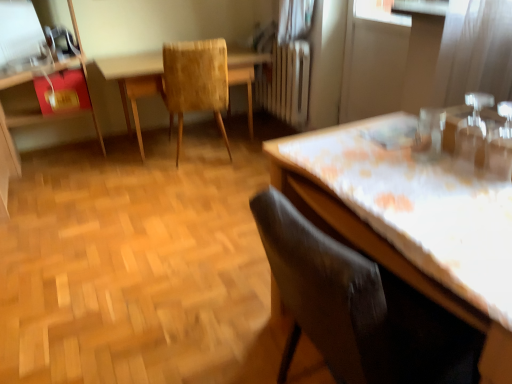
Where is `vacant space in matte red dresser at left (from a real-world perspective)`? The height and width of the screenshot is (384, 512). vacant space in matte red dresser at left (from a real-world perspective) is located at coordinates (56, 177).